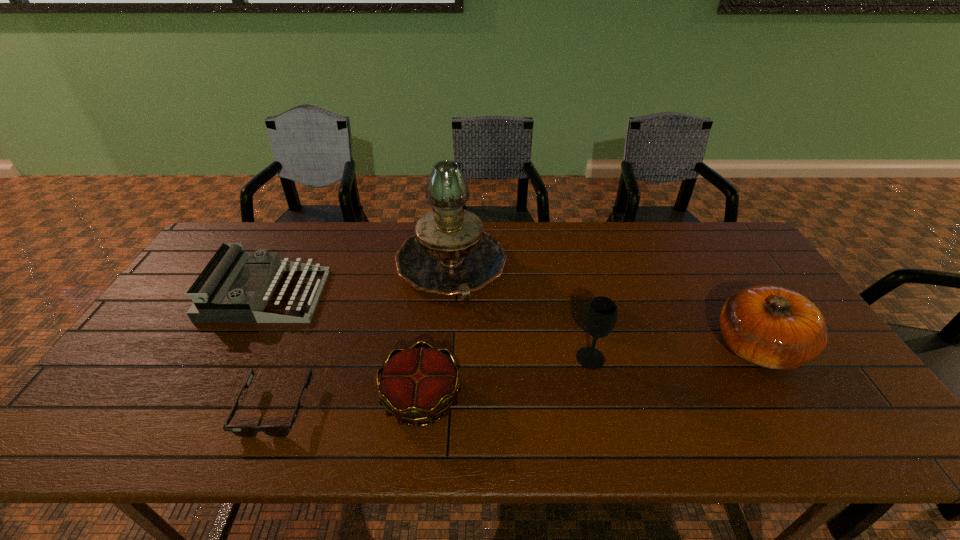
Locate an element on the screen. vacant region that satisfies the following two spatial constraints: 1. on the typing side of the typewriter; 2. on the left side of the rightmost object is located at coordinates tap(238, 347).

At what (x,y) coordinates should I click in order to perform the action: click on vacant area that satisfies the following two spatial constraints: 1. on the typing side of the typewriter; 2. on the left side of the rightmost object. Please return your answer as a coordinate pair (x, y). Looking at the image, I should click on (238, 347).

At what (x,y) coordinates should I click in order to perform the action: click on free space that satisfies the following two spatial constraints: 1. on the typing side of the typewriter; 2. on the right side of the pumpkin. Please return your answer as a coordinate pair (x, y). The height and width of the screenshot is (540, 960). Looking at the image, I should click on click(238, 347).

Locate an element on the screen. This screenshot has width=960, height=540. vacant space that satisfies the following two spatial constraints: 1. on the back side of the pumpkin; 2. on the left side of the crown is located at coordinates (427, 347).

The height and width of the screenshot is (540, 960). I want to click on free space in the image that satisfies the following two spatial constraints: 1. on the typing side of the typewriter; 2. on the back side of the crown, so click(211, 399).

This screenshot has width=960, height=540. I want to click on free spot that satisfies the following two spatial constraints: 1. on the typing side of the typewriter; 2. on the back side of the crown, so click(211, 399).